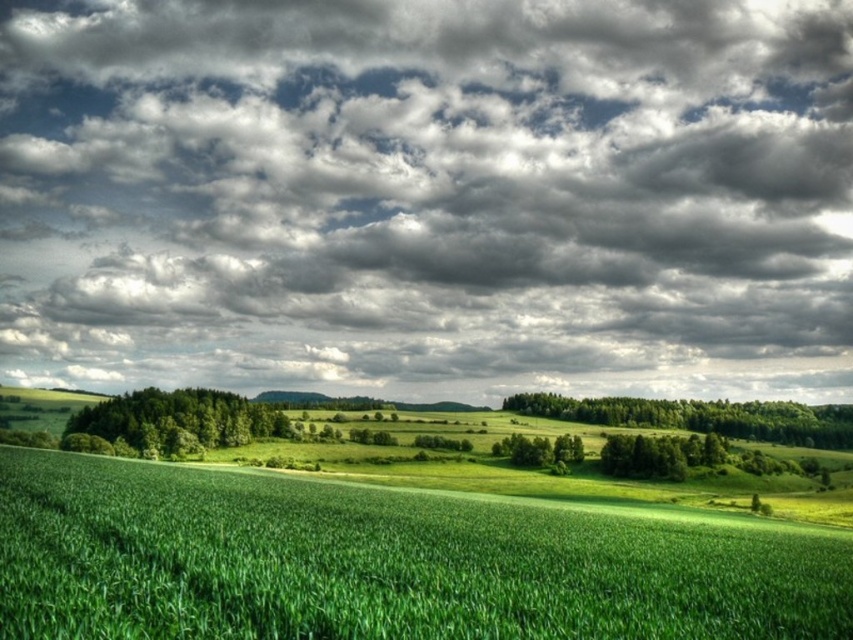
Question: Which object is farther from the camera taking this photo?

Choices:
 (A) green leafy forest at center
 (B) green leafy forest at right
 (C) green leafy tree at center

Answer: (B)

Question: Does cloudy sky at upper center appear over green leafy forest at center?

Choices:
 (A) yes
 (B) no

Answer: (A)

Question: Can you confirm if cloudy sky at upper center is positioned to the right of green leafy forest at center?

Choices:
 (A) no
 (B) yes

Answer: (B)

Question: Which of the following is the closest to the observer?

Choices:
 (A) green leafy forest at right
 (B) cloudy sky at upper center
 (C) green leafy tree at center
 (D) green leafy forest at center

Answer: (D)

Question: Does green leafy forest at right lie in front of green leafy forest at center?

Choices:
 (A) yes
 (B) no

Answer: (B)

Question: Which point is farther to the camera?

Choices:
 (A) green leafy forest at right
 (B) cloudy sky at upper center

Answer: (B)